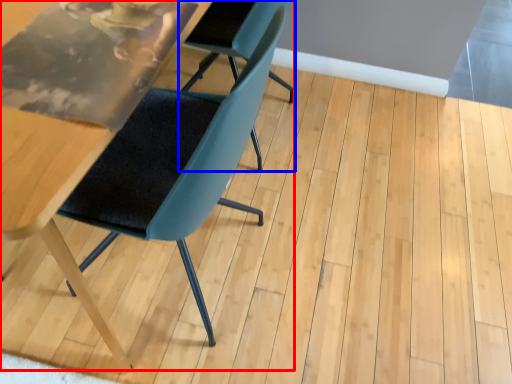
Question: Which object appears closest to the camera in this image, chair (highlighted by a red box) or chair (highlighted by a blue box)?

Choices:
 (A) chair
 (B) chair

Answer: (A)